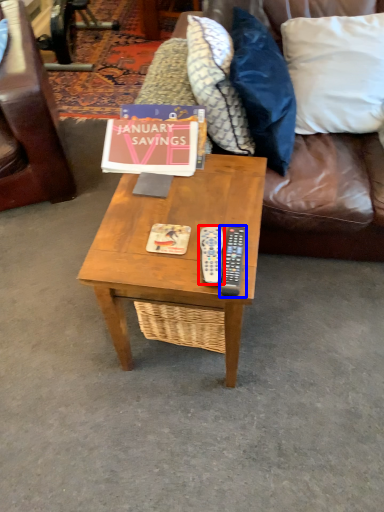
Question: Which object appears closest to the camera in this image, remote (highlighted by a red box) or remote (highlighted by a blue box)?

Choices:
 (A) remote
 (B) remote

Answer: (B)